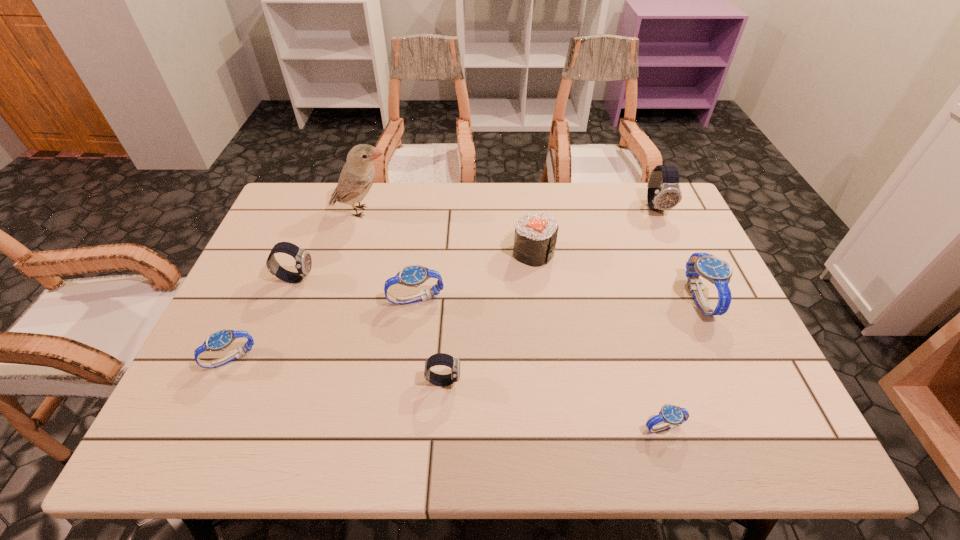
Locate an element on the screen. bird is located at coordinates point(357,176).

Find the location of a particular element. white bird is located at coordinates (357, 176).

At what (x,y) coordinates should I click in order to perform the action: click on the farthest dark watch. Please return your answer as a coordinate pair (x, y). Looking at the image, I should click on (663, 193).

The height and width of the screenshot is (540, 960). I want to click on the second tallest object, so coord(663,193).

Locate an element on the screen. Image resolution: width=960 pixels, height=540 pixels. the leftmost dark watch is located at coordinates (303, 259).

You are a GUI agent. You are given a task and a screenshot of the screen. Output one action in this format:
    pyautogui.click(x=<x>, y=<y>)
    Task: Click on the second farthest dark watch
    Image resolution: width=960 pixels, height=540 pixels.
    Given the screenshot: What is the action you would take?
    pyautogui.click(x=303, y=259)

The height and width of the screenshot is (540, 960). I want to click on the fourth object from right to left, so click(x=535, y=237).

Locate an element on the screen. The image size is (960, 540). sushi is located at coordinates (535, 237).

Identify the location of the biggest blue watch. This screenshot has width=960, height=540. (717, 271).

Find the location of a particular element. the second blue watch from left to right is located at coordinates (413, 275).